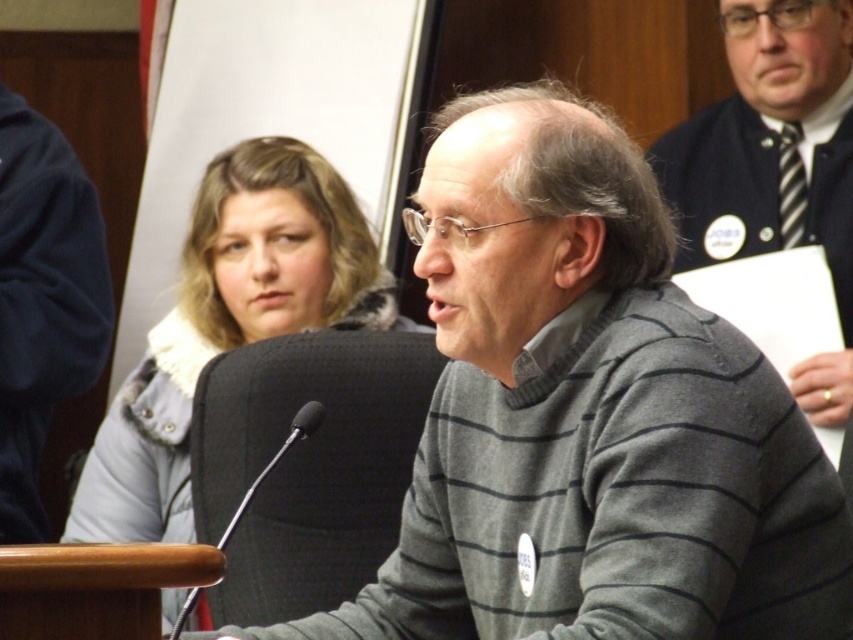
You are a photographer at the event and need to capture a photo of both the gray striped sweater at center and the striped sweater at upper right in the same frame. The camera you are using has a maximum focus range of 4 feet. Can you fit both subjects within the focus range?

The distance between the gray striped sweater at center and the striped sweater at upper right is 3.96 feet, which is within the camera focus range of 4 feet. Therefore, both subjects can be captured in the same frame.

You are attending a formal event and notice two sweaters in the scene. The first is the gray striped sweater at center, and the second is the striped sweater at upper right. Which of these two sweaters appears to be bigger in size?

The gray striped sweater at center appears to be bigger in size compared to the striped sweater at upper right.